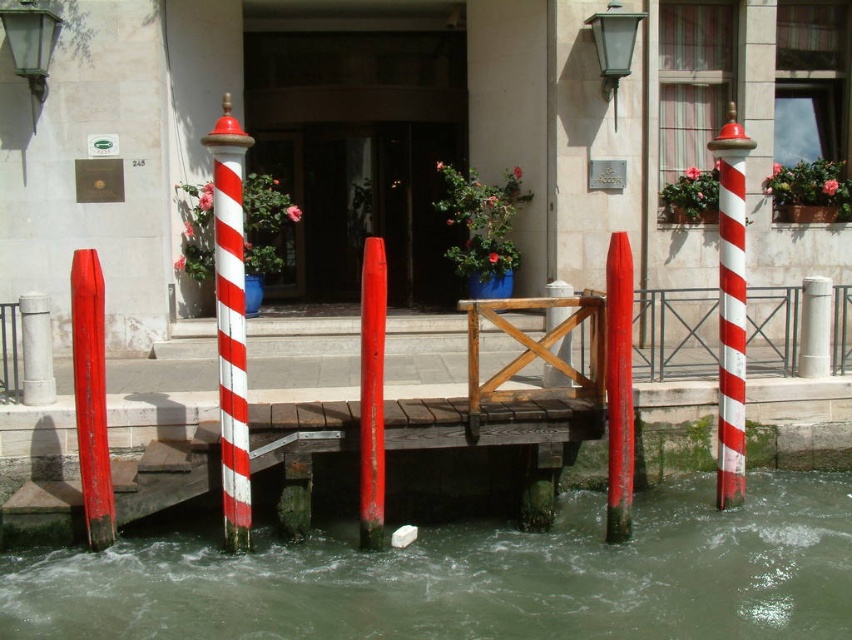
Question: Among these points, which one is farthest from the camera?

Choices:
 (A) (545, 502)
 (B) (608, 513)
 (C) (367, 312)

Answer: (A)

Question: Among these objects, which one is nearest to the camera?

Choices:
 (A) red striped pole at right
 (B) smooth red post at center

Answer: (B)

Question: Does greenish murky water at lower center have a greater width compared to smooth wooden post at center?

Choices:
 (A) yes
 (B) no

Answer: (A)

Question: From the image, what is the correct spatial relationship of red striped pole at right in relation to smooth red post at center?

Choices:
 (A) above
 (B) below

Answer: (A)

Question: Does smooth red post at lower left come in front of smooth red post at center?

Choices:
 (A) yes
 (B) no

Answer: (B)

Question: Which point appears farthest from the camera in this image?

Choices:
 (A) (79, 532)
 (B) (557, 320)
 (C) (111, 508)
 (D) (26, 312)

Answer: (B)